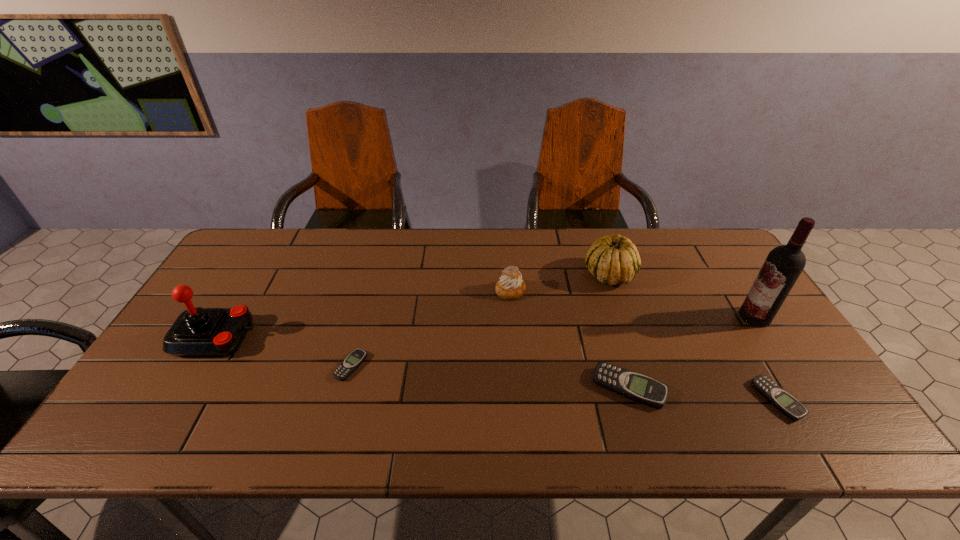
Locate an element on the screen. This screenshot has height=540, width=960. free region located 0.150m on the base of the joystick is located at coordinates click(311, 337).

The image size is (960, 540). I want to click on object at the far edge, so click(614, 260).

This screenshot has width=960, height=540. I want to click on object that is at the left edge, so click(198, 331).

At what (x,y) coordinates should I click in order to perform the action: click on beeper situated at the right edge. Please return your answer as a coordinate pair (x, y). The height and width of the screenshot is (540, 960). Looking at the image, I should click on (778, 397).

At what (x,y) coordinates should I click in order to perform the action: click on wine bottle that is at the right edge. Please return your answer as a coordinate pair (x, y). Looking at the image, I should click on 784,264.

Where is `object that is positioned at the near right corner`? The height and width of the screenshot is (540, 960). object that is positioned at the near right corner is located at coordinates (778, 397).

Find the location of a particular element. This screenshot has height=540, width=960. free space at the far edge of the desktop is located at coordinates (319, 258).

The height and width of the screenshot is (540, 960). In the image, there is a desktop. In order to click on free space at the near edge in this screenshot , I will do `click(512, 379)`.

In the image, there is a desktop. Where is `vacant space at the left edge`? Image resolution: width=960 pixels, height=540 pixels. vacant space at the left edge is located at coordinates (222, 291).

Where is `vacant space at the right edge of the desktop`? The width and height of the screenshot is (960, 540). vacant space at the right edge of the desktop is located at coordinates (708, 276).